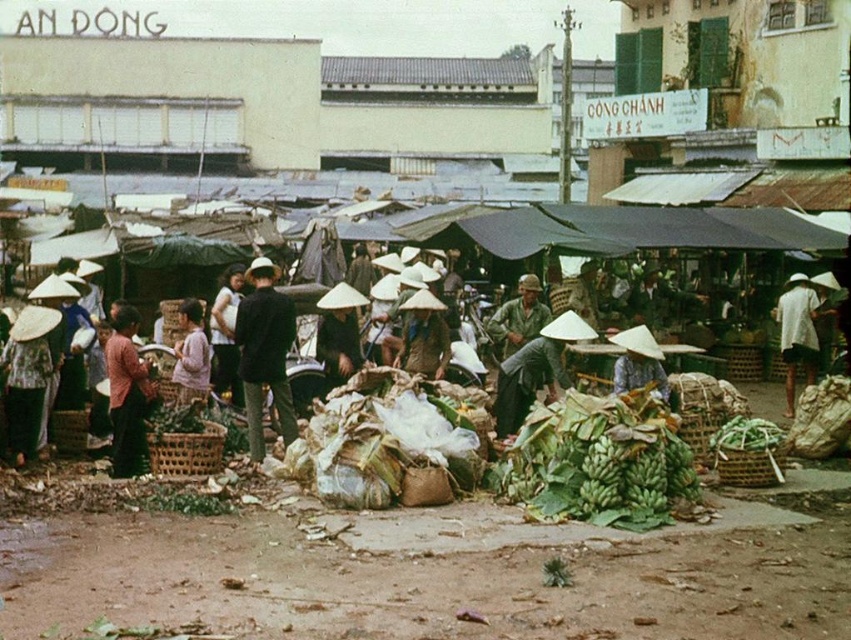
Question: Can you confirm if matte brown woven basket at center is bigger than light brown fabric shirt at center?

Choices:
 (A) yes
 (B) no

Answer: (A)

Question: Considering the real-world distances, which object is closest to the purple cotton shirt at center?

Choices:
 (A) matte white conical hat at left
 (B) brown woven hat at center
 (C) white woven hat at center
 (D) matte brown woven basket at center

Answer: (D)

Question: Is white woven hat at center further to the viewer compared to dark brown woven hat at center?

Choices:
 (A) no
 (B) yes

Answer: (B)

Question: Which object appears closest to the camera in this image?

Choices:
 (A) light brown fabric shirt at center
 (B) matte straw hat at center

Answer: (B)

Question: Among these points, which one is nearest to the camera?

Choices:
 (A) (340, 362)
 (B) (441, 317)

Answer: (B)

Question: Can you confirm if matte brown woven basket at center is bigger than dark brown woven hat at center?

Choices:
 (A) no
 (B) yes

Answer: (B)